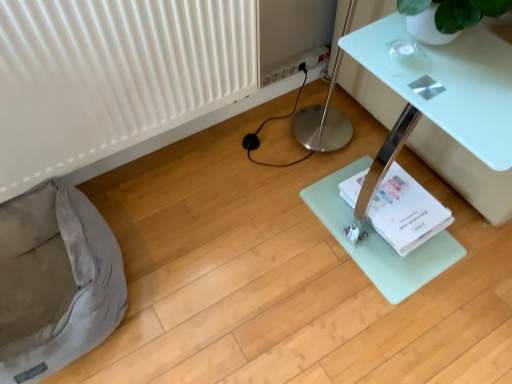
Question: Should I look upward or downward to see white glossy table at lower right?

Choices:
 (A) down
 (B) up

Answer: (B)

Question: Does gray fabric bean bag at lower left have a greater width compared to white glossy table at lower right?

Choices:
 (A) no
 (B) yes

Answer: (A)

Question: Is gray fabric bean bag at lower left positioned far away from white glossy table at lower right?

Choices:
 (A) no
 (B) yes

Answer: (B)

Question: Could you tell me if gray fabric bean bag at lower left is facing white glossy table at lower right?

Choices:
 (A) yes
 (B) no

Answer: (B)

Question: Would you say gray fabric bean bag at lower left is outside white glossy table at lower right?

Choices:
 (A) no
 (B) yes

Answer: (B)

Question: Considering the relative positions of gray fabric bean bag at lower left and white glossy table at lower right in the image provided, is gray fabric bean bag at lower left behind white glossy table at lower right?

Choices:
 (A) no
 (B) yes

Answer: (B)

Question: Does gray fabric bean bag at lower left come in front of white glossy table at lower right?

Choices:
 (A) no
 (B) yes

Answer: (A)

Question: Is white plastic power strip at upper center oriented towards gray fabric bean bag at lower left?

Choices:
 (A) no
 (B) yes

Answer: (A)

Question: Can you confirm if white plastic power strip at upper center is smaller than gray fabric bean bag at lower left?

Choices:
 (A) yes
 (B) no

Answer: (A)

Question: Is the position of white plastic power strip at upper center more distant than that of gray fabric bean bag at lower left?

Choices:
 (A) no
 (B) yes

Answer: (B)

Question: Is white plastic power strip at upper center with gray fabric bean bag at lower left?

Choices:
 (A) no
 (B) yes

Answer: (A)

Question: Can you confirm if white plastic power strip at upper center is shorter than gray fabric bean bag at lower left?

Choices:
 (A) no
 (B) yes

Answer: (B)

Question: Is white plastic power strip at upper center surrounding gray fabric bean bag at lower left?

Choices:
 (A) no
 (B) yes

Answer: (A)

Question: Does white ribbed radiator at lower left have a larger size compared to white plastic power strip at upper center?

Choices:
 (A) no
 (B) yes

Answer: (B)